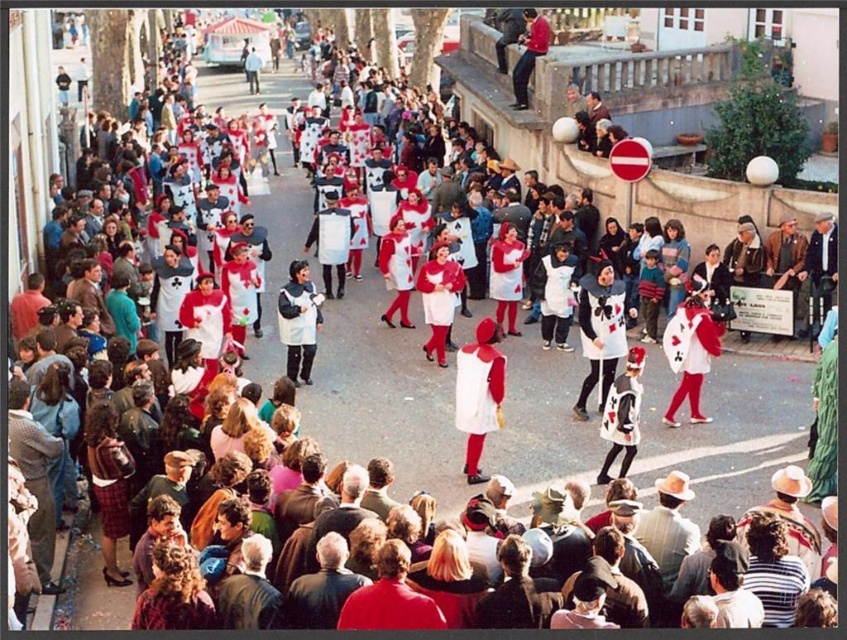
You are a photographer standing at the center of the street, and you want to take a photo that includes both the point at (178, 616) and the point at (474, 566). Which point should you focus on first to ensure both are in sharp focus?

You should focus on the point at (178, 616) first because it is closer to the camera than the point at (474, 566). This ensures the closer point is in focus, and the farther point will also be within the depth of field.

You are standing at the bottom right corner of the image. You want to locate the matte red coat at lower left. In which direction should you look relative to your position?

Since you are at the bottom right corner of the image, the matte red coat at lower left is to the left of your position.